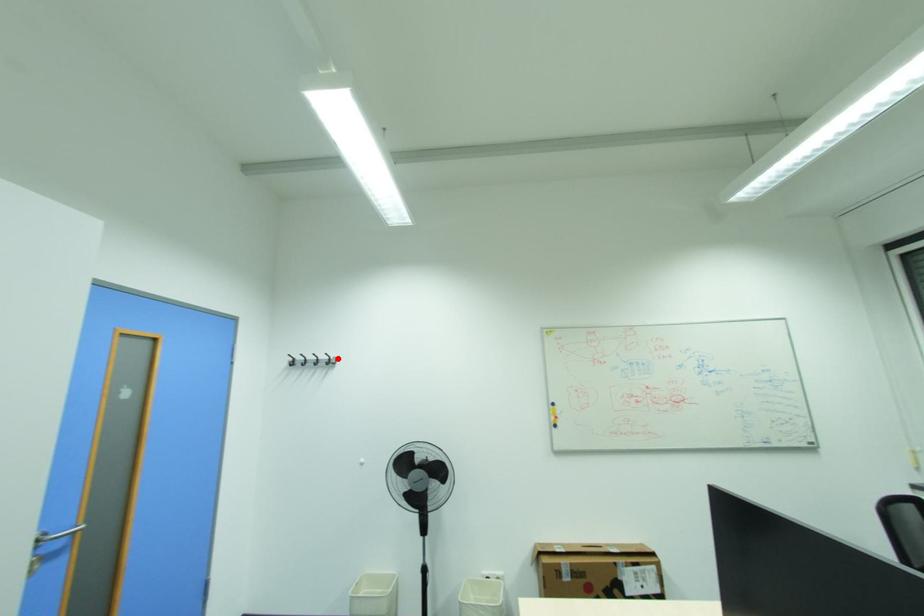
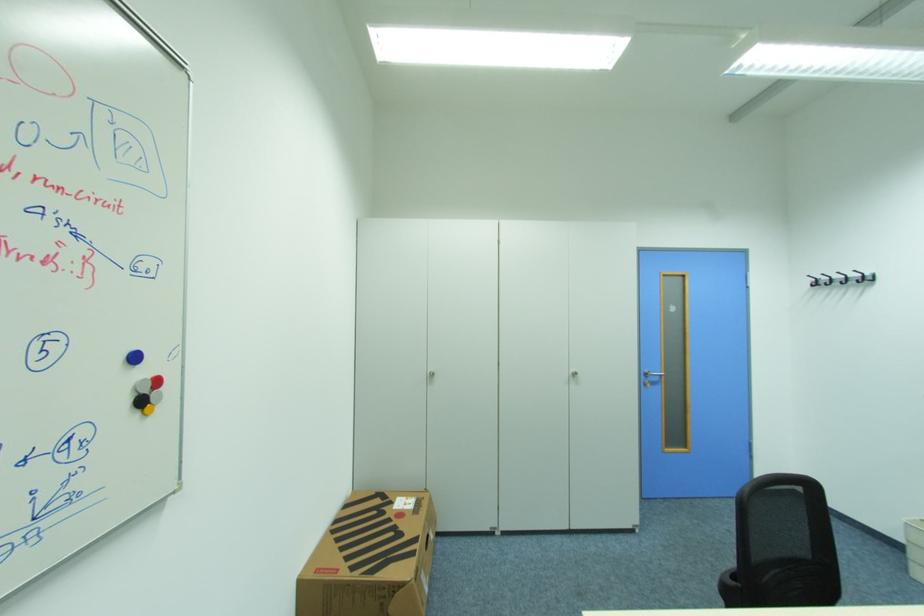
Locate, in the second image, the point that corresponds to the highlighted location in the first image.

(872, 275)